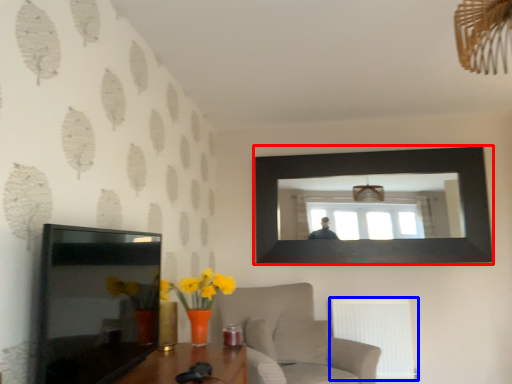
Question: Which point is closer to the camera, picture frame (highlighted by a red box) or radiator (highlighted by a blue box)?

Choices:
 (A) picture frame
 (B) radiator

Answer: (B)